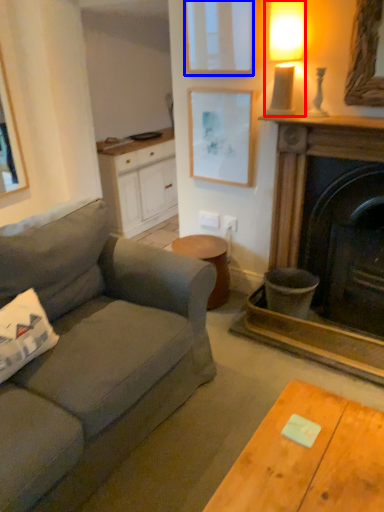
Question: Which point is further to the camera, lamp (highlighted by a red box) or picture frame (highlighted by a blue box)?

Choices:
 (A) lamp
 (B) picture frame

Answer: (B)